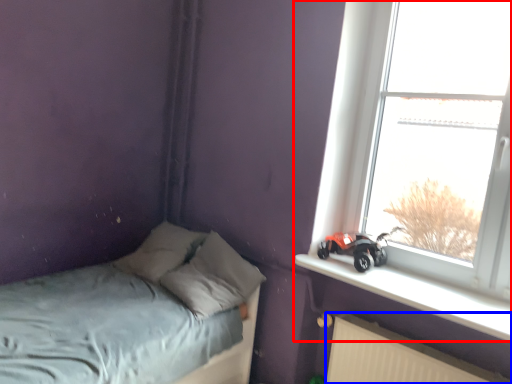
Question: Which object is closer to the camera taking this photo, window (highlighted by a red box) or radiator (highlighted by a blue box)?

Choices:
 (A) window
 (B) radiator

Answer: (B)